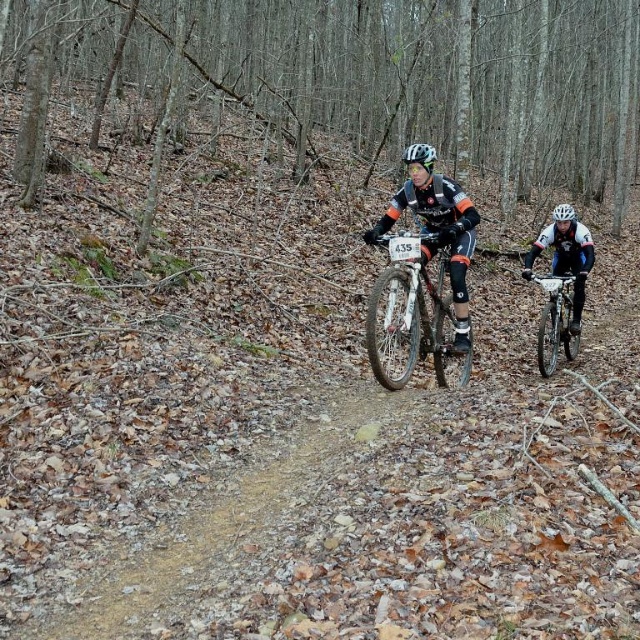
Question: Is shiny silver bicycle at right above white matte bicycle helmet at center?

Choices:
 (A) yes
 (B) no

Answer: (B)

Question: Which point appears farthest from the camera in this image?

Choices:
 (A) (560, 205)
 (B) (419, 147)
 (C) (406, 285)

Answer: (A)

Question: Is white matte helmet at upper right to the right of white matte helmet at center from the viewer's perspective?

Choices:
 (A) no
 (B) yes

Answer: (B)

Question: Based on their relative distances, which object is farther from the white matte helmet at center?

Choices:
 (A) shiny silver bicycle at right
 (B) shiny metallic bicycle at center

Answer: (A)

Question: Which point appears closest to the camera in this image?

Choices:
 (A) (429, 148)
 (B) (378, 356)
 (C) (536, 246)
 (D) (564, 218)

Answer: (B)

Question: Is white matte helmet at upper right positioned before shiny silver bicycle at right?

Choices:
 (A) yes
 (B) no

Answer: (B)